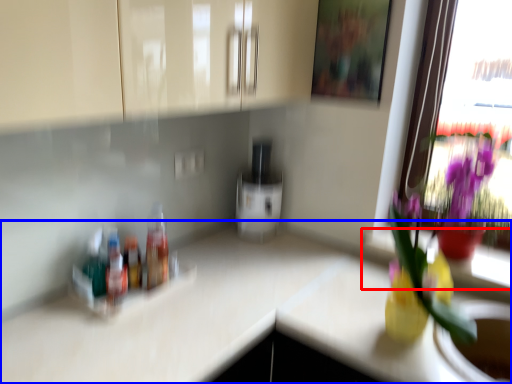
Question: Which point is closer to the camera, window sill (highlighted by a red box) or countertop (highlighted by a blue box)?

Choices:
 (A) window sill
 (B) countertop

Answer: (B)